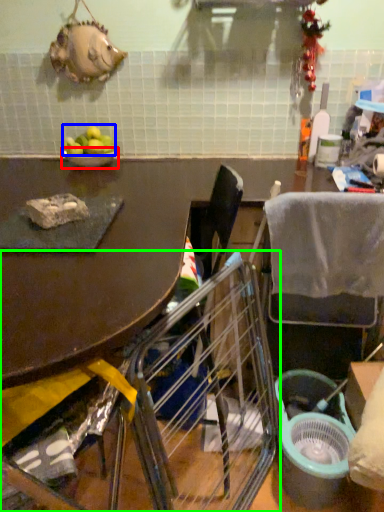
Question: Based on their relative distances, which object is farther from bowl (highlighted by a red box)? Choose from fruit (highlighted by a blue box) and chair (highlighted by a green box).

Choices:
 (A) fruit
 (B) chair

Answer: (B)